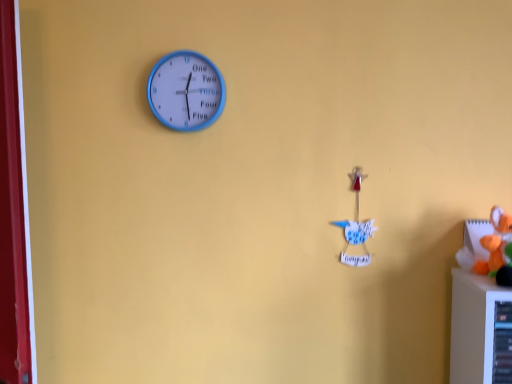
What is the approximate height of orange plush toy at right, the second toy in the left-to-right sequence?

orange plush toy at right, the second toy in the left-to-right sequence, is 6.88 inches tall.

What is the approximate width of white paper bird at center-right, which is counted as the first toy, starting from the left?

The width of white paper bird at center-right, which is counted as the first toy, starting from the left, is 1.68 inches.

The height and width of the screenshot is (384, 512). I want to click on white paper bird at center-right, positioned as the 2th toy in front-to-back order, so click(x=356, y=227).

Where is `orange plush toy at right, the second toy in the left-to-right sequence`? The width and height of the screenshot is (512, 384). orange plush toy at right, the second toy in the left-to-right sequence is located at coordinates (497, 249).

Would you say blue plastic clock at upper left is inside or outside orange plush toy at right, which ranks as the 1th toy in front-to-back order?

blue plastic clock at upper left is outside orange plush toy at right, which ranks as the 1th toy in front-to-back order.

Considering the sizes of objects blue plastic clock at upper left and orange plush toy at right, which ranks as the 1th toy in front-to-back order, in the image provided, who is smaller, blue plastic clock at upper left or orange plush toy at right, which ranks as the 1th toy in front-to-back order,?

With smaller size is blue plastic clock at upper left.

Is blue plastic clock at upper left further to the viewer compared to orange plush toy at right, which ranks as the 1th toy in front-to-back order?

Yes, blue plastic clock at upper left is further from the viewer.

Does blue plastic clock at upper left have a lesser width compared to orange plush toy at right, which ranks as the 1th toy in front-to-back order?

Correct, the width of blue plastic clock at upper left is less than that of orange plush toy at right, which ranks as the 1th toy in front-to-back order.

Considering the sizes of blue plastic clock at upper left and white paper bird at center-right, which is counted as the first toy, starting from the left, in the image, is blue plastic clock at upper left wider or thinner than white paper bird at center-right, which is counted as the first toy, starting from the left,?

Considering their sizes, blue plastic clock at upper left looks slimmer than white paper bird at center-right, which is counted as the first toy, starting from the left.

Considering their positions, is blue plastic clock at upper left located in front of or behind white paper bird at center-right, positioned as the 2th toy in front-to-back order?

blue plastic clock at upper left is behind white paper bird at center-right, positioned as the 2th toy in front-to-back order.

Is the surface of blue plastic clock at upper left in direct contact with white paper bird at center-right, acting as the 2th toy starting from the right?

No, blue plastic clock at upper left is not making contact with white paper bird at center-right, acting as the 2th toy starting from the right.

Can you see white paper bird at center-right, the 1th toy in the back-to-front sequence, touching orange plush toy at right, which ranks as the 1th toy in right-to-left order?

white paper bird at center-right, the 1th toy in the back-to-front sequence, and orange plush toy at right, which ranks as the 1th toy in right-to-left order, are not in contact.

From the picture: Does white paper bird at center-right, which is counted as the first toy, starting from the left, have a greater height compared to orange plush toy at right, which appears as the second toy when viewed from the back?

Yes, white paper bird at center-right, which is counted as the first toy, starting from the left, is taller than orange plush toy at right, which appears as the second toy when viewed from the back.

From the picture: Is white paper bird at center-right, positioned as the 2th toy in front-to-back order, oriented towards orange plush toy at right, which appears as the second toy when viewed from the back?

No, white paper bird at center-right, positioned as the 2th toy in front-to-back order, is not aimed at orange plush toy at right, which appears as the second toy when viewed from the back.

Which is closer, (361, 169) or (506, 271)?

The point (506, 271) is closer.

Who is taller, white paper bird at center-right, acting as the 2th toy starting from the right, or blue plastic clock at upper left?

white paper bird at center-right, acting as the 2th toy starting from the right, is taller.

What are the coordinates of `wall clock lying on the left of white paper bird at center-right, which is counted as the first toy, starting from the left` in the screenshot? It's located at (186, 91).

Which is correct: white paper bird at center-right, which is counted as the first toy, starting from the left, is inside blue plastic clock at upper left, or outside of it?

white paper bird at center-right, which is counted as the first toy, starting from the left, cannot be found inside blue plastic clock at upper left.

Does point (507, 221) appear closer or farther from the camera than point (204, 70)?

Point (507, 221).

Measure the distance from orange plush toy at right, the second toy in the left-to-right sequence, to blue plastic clock at upper left.

orange plush toy at right, the second toy in the left-to-right sequence, and blue plastic clock at upper left are 30.99 inches apart from each other.

From a real-world perspective, between orange plush toy at right, the second toy in the left-to-right sequence, and blue plastic clock at upper left, who is vertically higher?

blue plastic clock at upper left is physically above.

Is orange plush toy at right, which ranks as the 1th toy in right-to-left order, located outside blue plastic clock at upper left?

Yes, orange plush toy at right, which ranks as the 1th toy in right-to-left order, is outside of blue plastic clock at upper left.

From the image's perspective, is orange plush toy at right, which ranks as the 1th toy in right-to-left order, above white paper bird at center-right, acting as the 2th toy starting from the right?

No, from the image's perspective, orange plush toy at right, which ranks as the 1th toy in right-to-left order, is not above white paper bird at center-right, acting as the 2th toy starting from the right.

Is orange plush toy at right, the second toy in the left-to-right sequence, to the left of white paper bird at center-right, which is counted as the first toy, starting from the left, from the viewer's perspective?

No.

Is white paper bird at center-right, positioned as the 2th toy in front-to-back order, a part of orange plush toy at right, the second toy in the left-to-right sequence?

That's incorrect, white paper bird at center-right, positioned as the 2th toy in front-to-back order, is not inside orange plush toy at right, the second toy in the left-to-right sequence.

From the picture: Is orange plush toy at right, the second toy in the left-to-right sequence, smaller than white paper bird at center-right, which is counted as the first toy, starting from the left?

Actually, orange plush toy at right, the second toy in the left-to-right sequence, might be larger than white paper bird at center-right, which is counted as the first toy, starting from the left.

I want to click on wall clock above the orange plush toy at right, the second toy in the left-to-right sequence (from the image's perspective), so click(186, 91).

Which toy is the 1st one when counting from the front of the blue plastic clock at upper left? Please provide its 2D coordinates.

[(356, 227)]

Based on their spatial positions, is white paper bird at center-right, which is counted as the first toy, starting from the left, or orange plush toy at right, which ranks as the 1th toy in right-to-left order, further from blue plastic clock at upper left?

orange plush toy at right, which ranks as the 1th toy in right-to-left order.

Based on their spatial positions, is orange plush toy at right, which ranks as the 1th toy in right-to-left order, or white paper bird at center-right, positioned as the 2th toy in front-to-back order, further from blue plastic clock at upper left?

Among the two, orange plush toy at right, which ranks as the 1th toy in right-to-left order, is located further to blue plastic clock at upper left.

Considering their positions, is white paper bird at center-right, positioned as the 2th toy in front-to-back order, positioned closer to orange plush toy at right, which ranks as the 1th toy in right-to-left order, than blue plastic clock at upper left?

white paper bird at center-right, positioned as the 2th toy in front-to-back order, is positioned closer to the anchor orange plush toy at right, which ranks as the 1th toy in right-to-left order.

When comparing their distances from white paper bird at center-right, which is counted as the first toy, starting from the left, does blue plastic clock at upper left or orange plush toy at right, which appears as the second toy when viewed from the back, seem further?

blue plastic clock at upper left lies further to white paper bird at center-right, which is counted as the first toy, starting from the left, than the other object.

Considering their positions, is orange plush toy at right, which ranks as the 1th toy in right-to-left order, positioned further to white paper bird at center-right, which is counted as the first toy, starting from the left, than blue plastic clock at upper left?

blue plastic clock at upper left is positioned further to the anchor white paper bird at center-right, which is counted as the first toy, starting from the left.

Considering their positions, is blue plastic clock at upper left positioned closer to orange plush toy at right, which ranks as the 1th toy in front-to-back order, than white paper bird at center-right, the 1th toy in the back-to-front sequence?

Based on the image, white paper bird at center-right, the 1th toy in the back-to-front sequence, appears to be nearer to orange plush toy at right, which ranks as the 1th toy in front-to-back order.

Where is `toy located between blue plastic clock at upper left and orange plush toy at right, which appears as the second toy when viewed from the back, in the left-right direction`? This screenshot has height=384, width=512. toy located between blue plastic clock at upper left and orange plush toy at right, which appears as the second toy when viewed from the back, in the left-right direction is located at coordinates (356, 227).